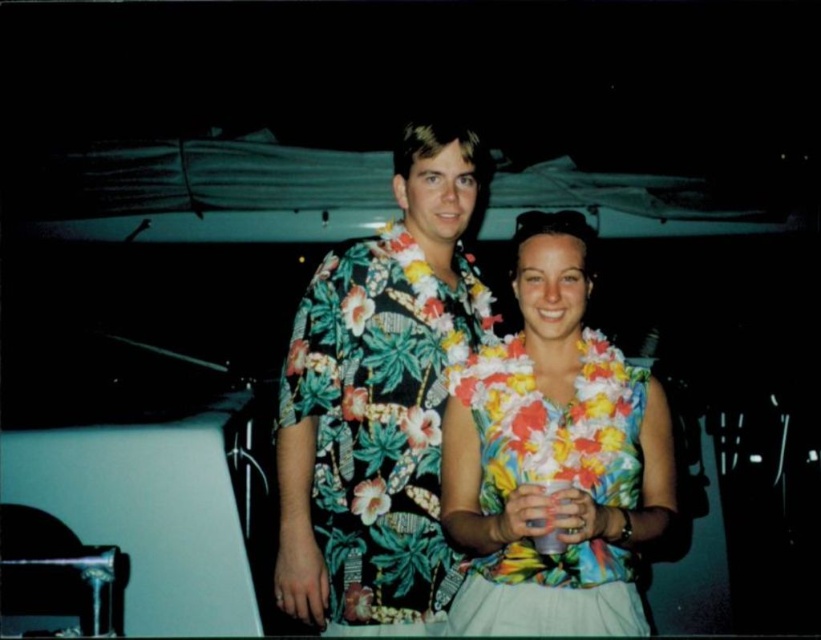
You are at a party and want to grab the translucent plastic cup at center without touching the floral print shirt at center. Is it possible?

The translucent plastic cup at center is behind the floral print shirt at center, so you can reach around the back side to grab it without touching the floral print shirt at center.

You are a photographer at the event and want to capture a clear shot of both the floral fabric lei at center and the translucent plastic cup at center. Since the lei is taller than the cup, which object should you focus on first to ensure both are in frame?

The floral fabric lei at center is taller than the translucent plastic cup at center, so you should focus on the floral fabric lei at center first to ensure both are in frame.

In the scene shown: You are a photographer at a party and want to take a closeup shot of the floral fabric lei at center and the translucent plastic cup at center. Which object should you focus on first to ensure both are in focus?

The floral fabric lei at center is closer to the viewer than the translucent plastic cup at center, so you should focus on the floral fabric lei at center first to ensure both are in focus.